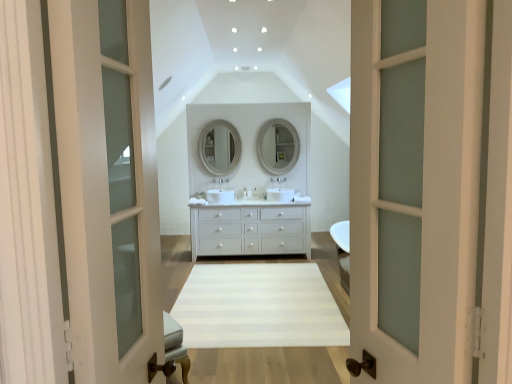
Where is `vacant area on top of white striped rug at center (from a real-world perspective)`? vacant area on top of white striped rug at center (from a real-world perspective) is located at coordinates (243, 304).